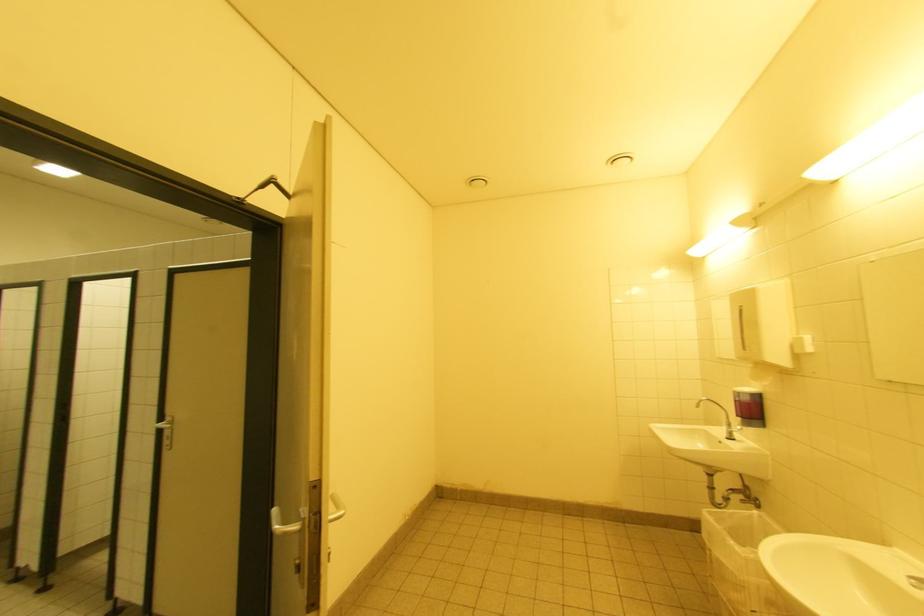
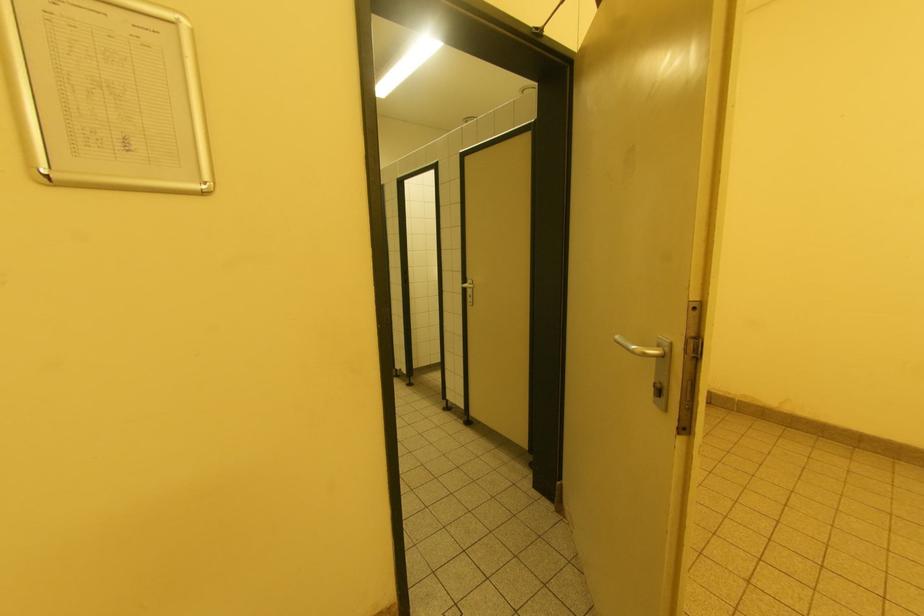
Question: The images are taken continuously from a first-person perspective. In which direction is your viewpoint rotating?

Choices:
 (A) Left
 (B) Right
 (C) Up
 (D) Down

Answer: (A)